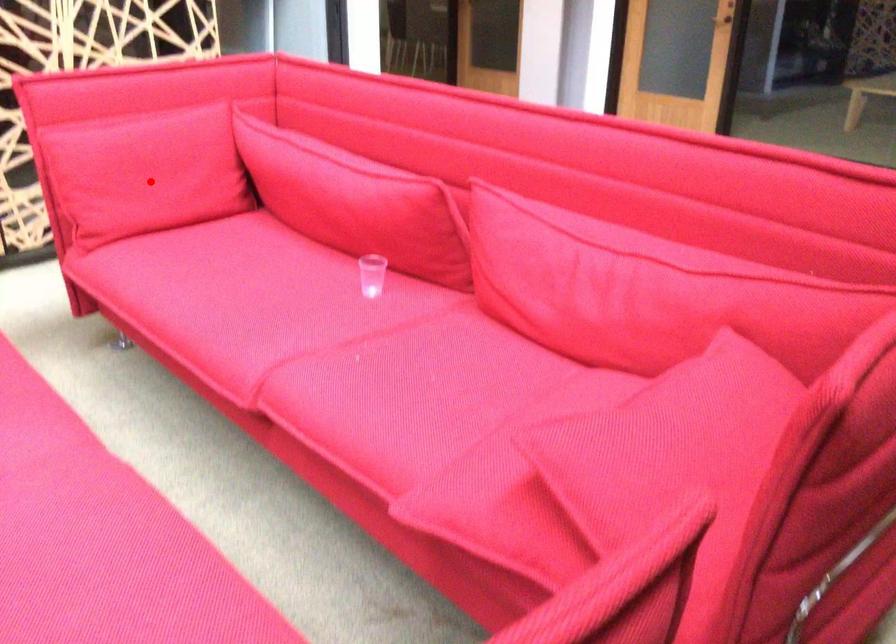
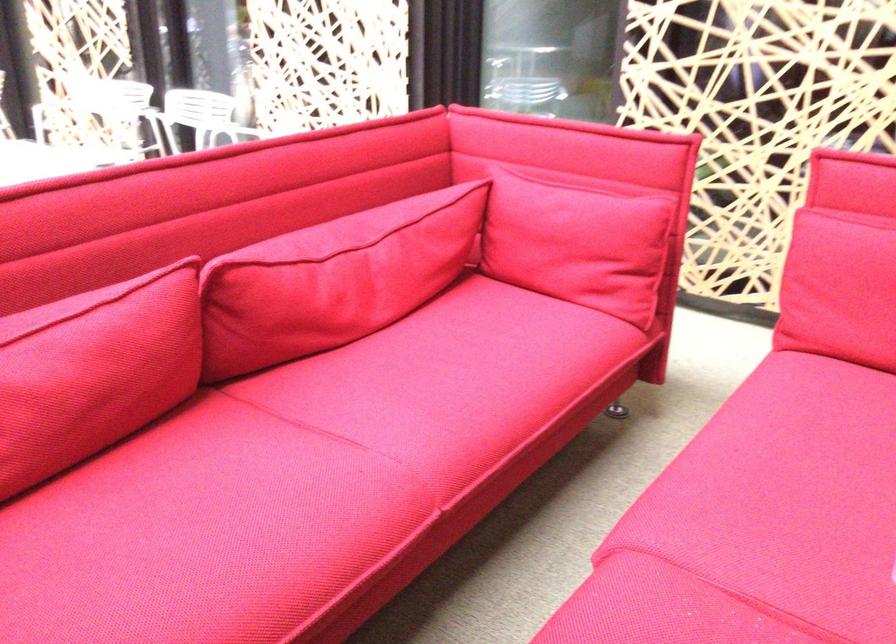
Question: I am providing you with two images of the same scene from different viewpoints. Given a red point in image1, look at the same physical point in image2. Is it:

Choices:
 (A) Closer to the viewpoint
 (B) Farther from the viewpoint

Answer: (A)